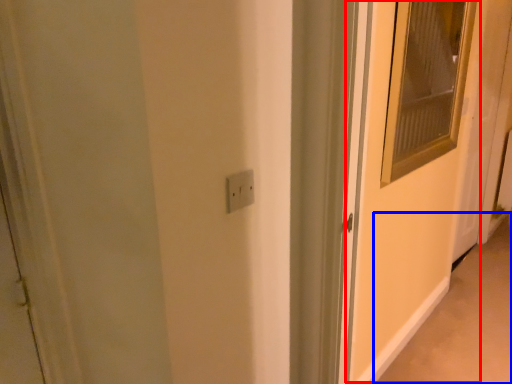
Question: Among these objects, which one is nearest to the camera, screen door (highlighted by a red box) or alley (highlighted by a blue box)?

Choices:
 (A) screen door
 (B) alley

Answer: (A)